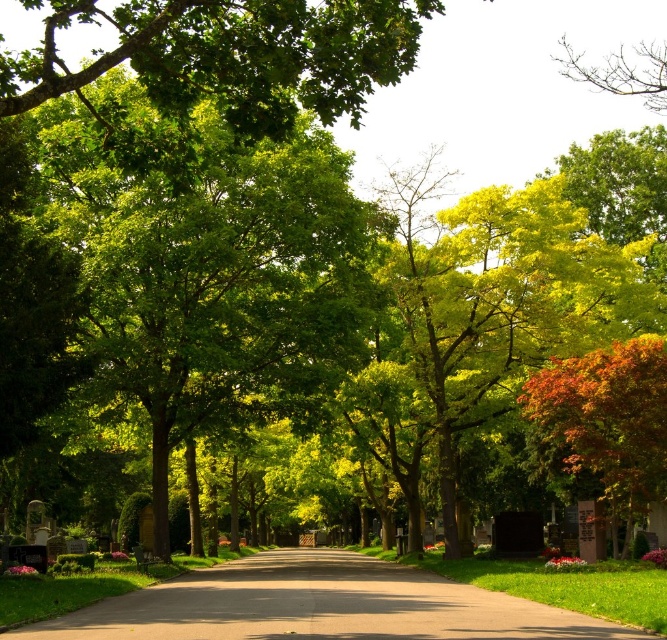
You are standing on the pathway and want to take a photo of both the green leafy tree at center and the autumnal leaves at right. Which object should you focus on first to ensure both are in clear view?

You should focus on the green leafy tree at center first because it is closer to you than the autumnal leaves at right, so adjusting focus from near to far will help both be in clear view.

You are a gardener trying to mow the grass between the smooth asphalt road at center and the autumnal leaves at right. Which area is wider so you can decide where to start?

The smooth asphalt road at center is wider than autumnal leaves at right, so you should start mowing the area near the autumnal leaves at right first since it is narrower.